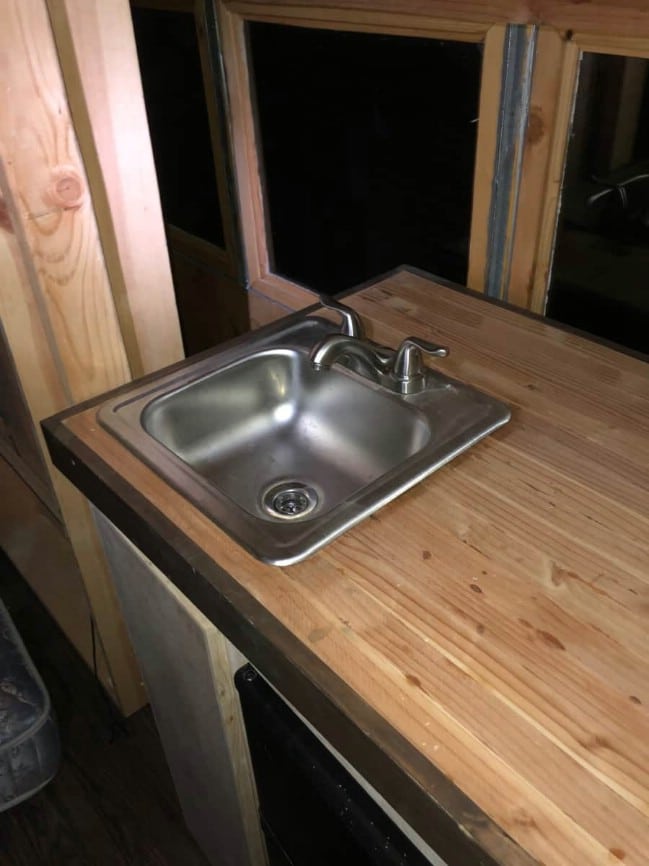
Identify the location of mattress corner. (42, 732).